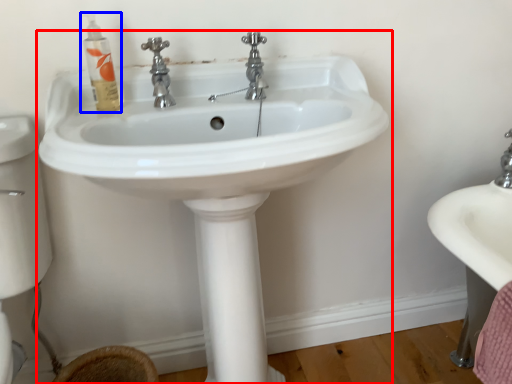
Question: Which point is closer to the camera, sink (highlighted by a red box) or mouthwash (highlighted by a blue box)?

Choices:
 (A) sink
 (B) mouthwash

Answer: (A)